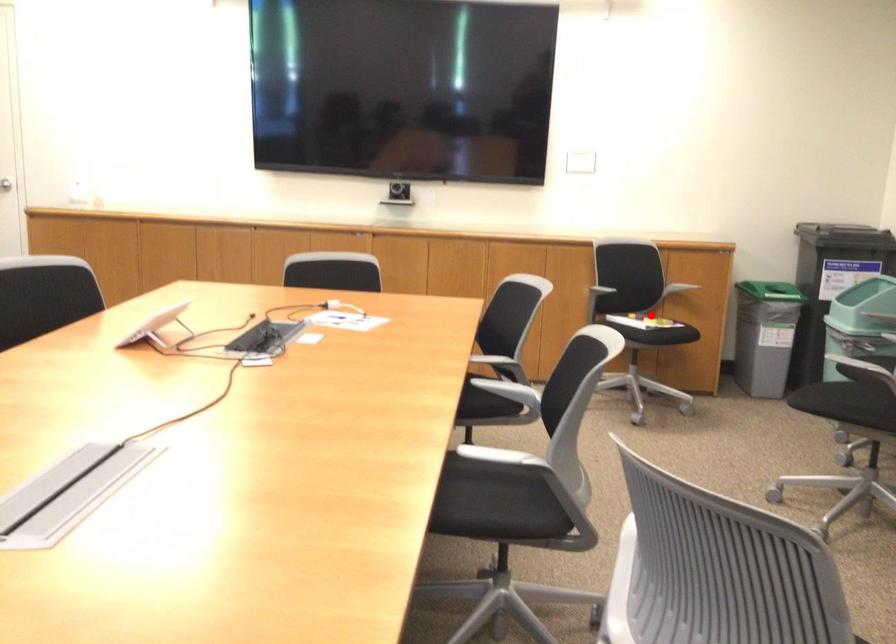
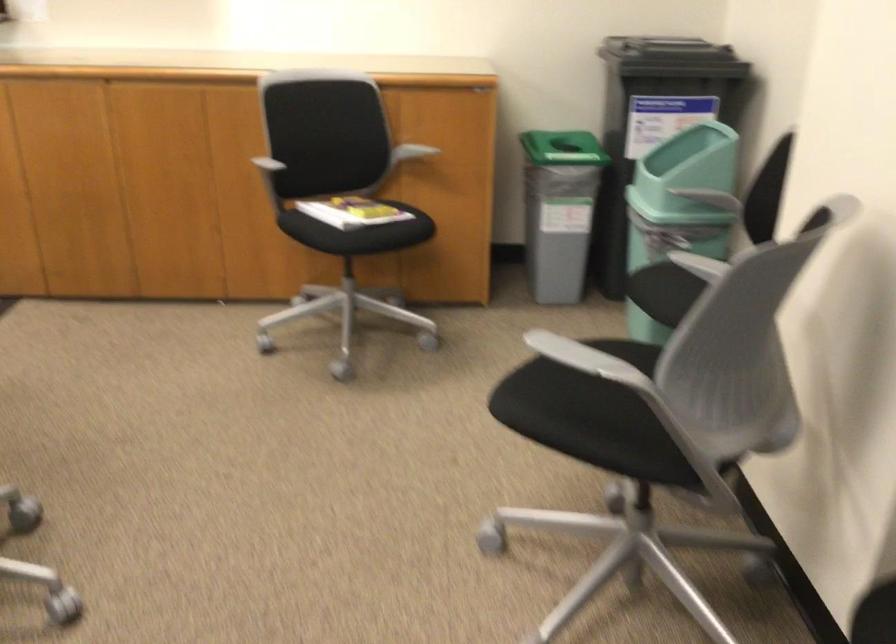
Locate, in the second image, the point that corresponds to the highlighted location in the first image.

(358, 232)